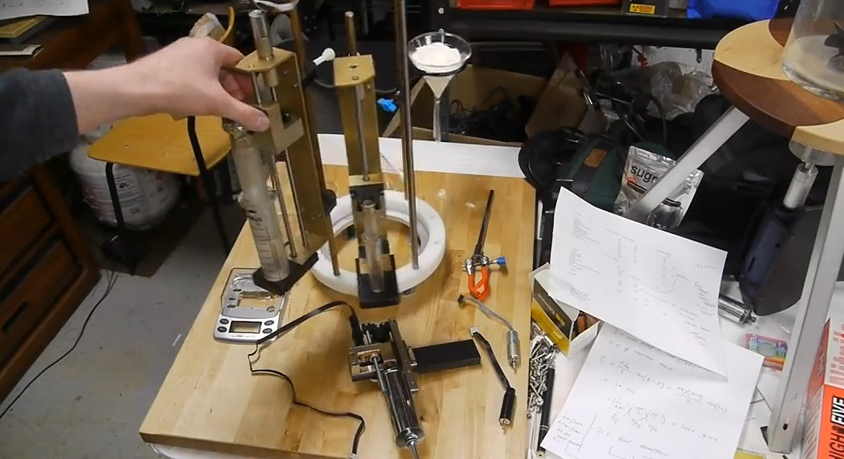
Find the location of a particular element. The width and height of the screenshot is (844, 459). brown chair is located at coordinates (154, 145).